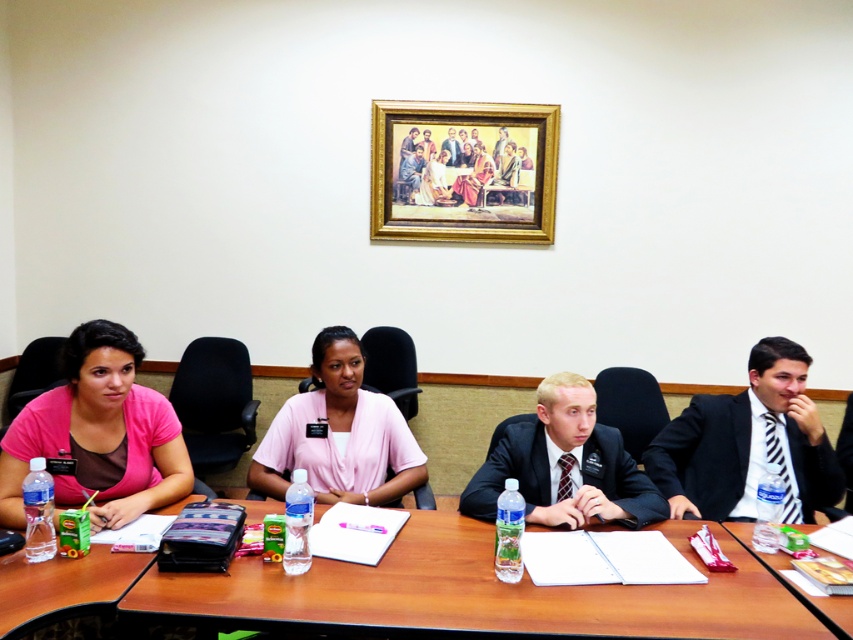
Question: Considering the real-world distances, which object is farthest from the gold-framed painting at upper center?

Choices:
 (A) wooden table at lower right
 (B) black suit at center
 (C) smooth gray suit at center
 (D) brown wooden table at center

Answer: (A)

Question: Is dark suit at center wider than smooth brown suit at center?

Choices:
 (A) yes
 (B) no

Answer: (A)

Question: Which of the following is the farthest from the observer?

Choices:
 (A) brown wooden table at center
 (B) pink matte shirt at left
 (C) smooth gray suit at center

Answer: (C)

Question: Can you confirm if wooden table at lower right is thinner than smooth brown suit at center?

Choices:
 (A) no
 (B) yes

Answer: (A)

Question: Which of these objects is positioned farthest from the gold-framed painting at upper center?

Choices:
 (A) pink matte shirt at left
 (B) brown wooden table at center
 (C) wooden table at lower right

Answer: (C)

Question: Does pink matte shirt at left have a smaller size compared to pink fabric shirt at center?

Choices:
 (A) yes
 (B) no

Answer: (B)